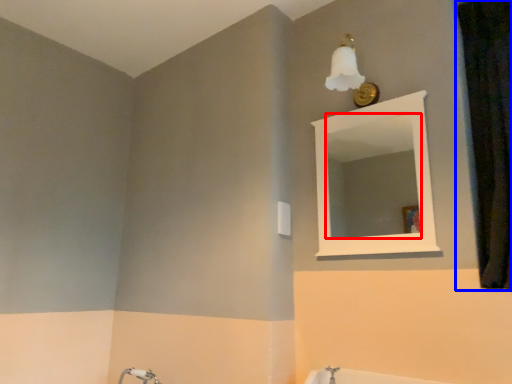
Question: Which point is further to the camera, mirror (highlighted by a red box) or curtain (highlighted by a blue box)?

Choices:
 (A) mirror
 (B) curtain

Answer: (A)